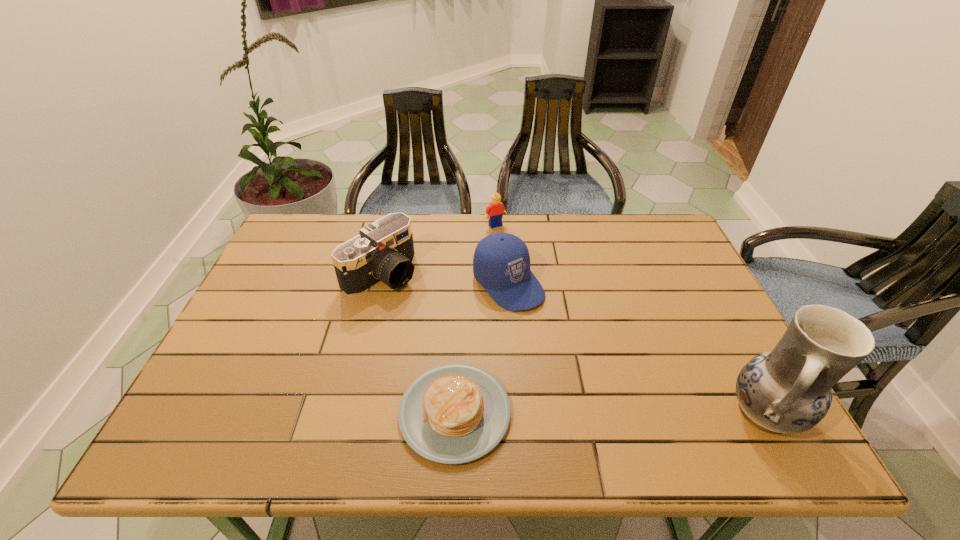
Locate an element on the screen. This screenshot has width=960, height=540. vacant region located 0.050m on the front-facing side of the camera is located at coordinates (418, 298).

You are a GUI agent. You are given a task and a screenshot of the screen. Output one action in this format:
    pyautogui.click(x=<x>, y=<y>)
    Task: Click on the vacant position located 0.230m on the front-facing side of the cap
    
    Given the screenshot: What is the action you would take?
    pyautogui.click(x=589, y=367)

Image resolution: width=960 pixels, height=540 pixels. I want to click on vacant point located on the front-facing side of the cap, so click(618, 395).

You are a GUI agent. You are given a task and a screenshot of the screen. Output one action in this format:
    pyautogui.click(x=<x>, y=<y>)
    Task: Click on the vacant space located on the front-facing side of the cap
    The height and width of the screenshot is (540, 960).
    Given the screenshot: What is the action you would take?
    pyautogui.click(x=541, y=320)

Identify the location of free space located on the face of the farthest object. (508, 239).

Locate an element on the screen. Image resolution: width=960 pixels, height=540 pixels. vacant space located on the face of the farthest object is located at coordinates (521, 257).

Where is `vacant area situated 0.180m on the face of the farthest object`? This screenshot has width=960, height=540. vacant area situated 0.180m on the face of the farthest object is located at coordinates (525, 261).

The width and height of the screenshot is (960, 540). Find the location of `camera present at the far edge`. camera present at the far edge is located at coordinates (383, 252).

At what (x,y) coordinates should I click in order to perform the action: click on cap situated at the far edge. Please return your answer as a coordinate pair (x, y). Image resolution: width=960 pixels, height=540 pixels. Looking at the image, I should click on (501, 263).

Where is `Lego that is at the far edge`? This screenshot has width=960, height=540. Lego that is at the far edge is located at coordinates (496, 208).